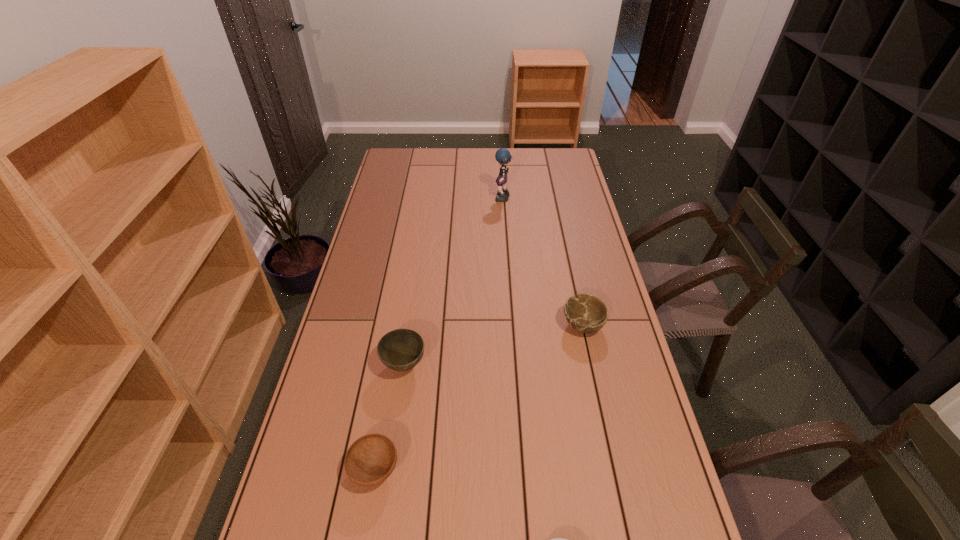
Locate an element on the screen. This screenshot has width=960, height=540. free spot between the shortest bowl and the rightmost bowl is located at coordinates (479, 397).

Locate an element on the screen. The height and width of the screenshot is (540, 960). vacant area that lies between the rightmost object and the farthest object is located at coordinates (542, 262).

Find the location of `vacant region between the fourth farthest object and the rightmost bowl`. vacant region between the fourth farthest object and the rightmost bowl is located at coordinates (479, 397).

You are a GUI agent. You are given a task and a screenshot of the screen. Output one action in this format:
    pyautogui.click(x=<x>, y=<y>)
    Task: Click on the vacant space that is in between the farthest bowl and the shortest bowl
    This screenshot has width=960, height=540.
    Given the screenshot: What is the action you would take?
    [479, 397]

At what (x,y) coordinates should I click in order to perform the action: click on vacant area between the tallest bowl and the fourth farthest object. Please return your answer as a coordinate pair (x, y). Image resolution: width=960 pixels, height=540 pixels. Looking at the image, I should click on (390, 417).

Where is `vacant point located between the farthest object and the nearest bowl`? The width and height of the screenshot is (960, 540). vacant point located between the farthest object and the nearest bowl is located at coordinates (439, 334).

Identify the location of free space between the shortest bowl and the tallest object. This screenshot has width=960, height=540. (439, 334).

The image size is (960, 540). Find the location of `object that is the second closest to the fourth farthest object`. object that is the second closest to the fourth farthest object is located at coordinates (554, 539).

Locate which object ranks in proximity to the rag doll. Please provide its 2D coordinates. Your answer should be formatted as a tuple, i.e. [(x, y)], where the tuple contains the x and y coordinates of a point satisfying the conditions above.

[(587, 314)]

Where is `bowl that stands as the closest to the shortest object`? bowl that stands as the closest to the shortest object is located at coordinates pyautogui.click(x=370, y=460).